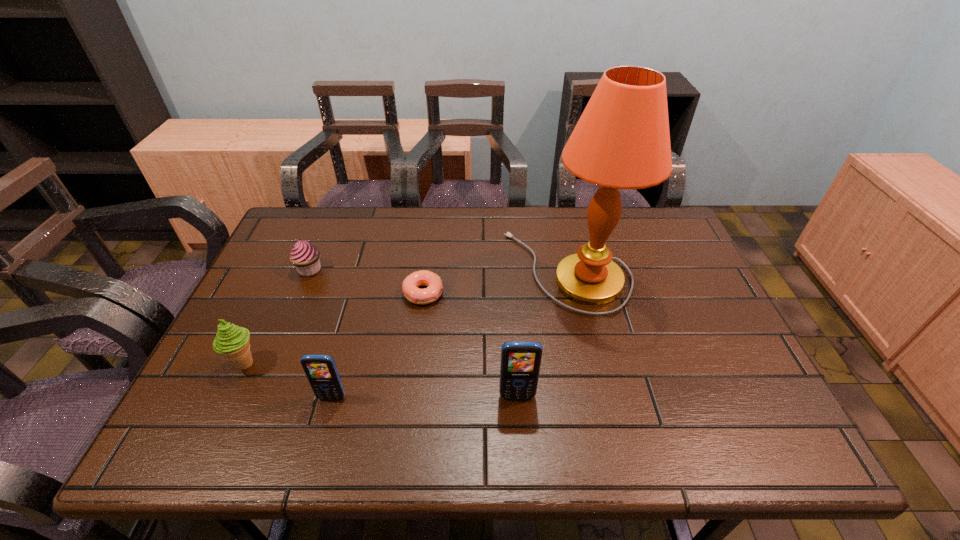
Where is `free space located on the front of the second shortest object`? The width and height of the screenshot is (960, 540). free space located on the front of the second shortest object is located at coordinates (300, 292).

What are the coordinates of `vacant space located on the left of the third object from right to left` in the screenshot? It's located at (298, 293).

The image size is (960, 540). In order to click on free spot located 0.320m on the back of the icecream in this screenshot , I will do `click(292, 263)`.

You are a GUI agent. You are given a task and a screenshot of the screen. Output one action in this format:
    pyautogui.click(x=<x>, y=<y>)
    Task: Click on the object present at the far edge
    This screenshot has width=960, height=540.
    Given the screenshot: What is the action you would take?
    pyautogui.click(x=622, y=141)

Image resolution: width=960 pixels, height=540 pixels. What are the coordinates of `cupcake located at the left edge` in the screenshot? It's located at (305, 256).

Where is `icecream that is at the left edge`? Image resolution: width=960 pixels, height=540 pixels. icecream that is at the left edge is located at coordinates (232, 341).

In the image, there is a desktop. Identify the location of vacant space at the far edge. The height and width of the screenshot is (540, 960). (518, 236).

This screenshot has width=960, height=540. I want to click on free region at the near edge of the desktop, so click(454, 409).

You are a GUI agent. You are given a task and a screenshot of the screen. Output one action in this format:
    pyautogui.click(x=<x>, y=<y>)
    Task: Click on the free space at the right edge
    Image resolution: width=960 pixels, height=540 pixels.
    Given the screenshot: What is the action you would take?
    pyautogui.click(x=690, y=275)

Locate an element on the screen. The width and height of the screenshot is (960, 540). free spot at the far left corner of the desktop is located at coordinates coord(298,231).